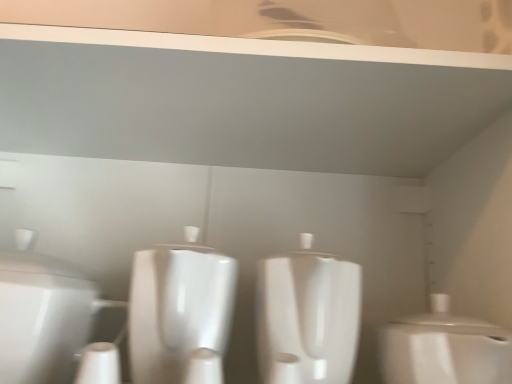
Question: Are white glossy toilet at center, acting as the 2th toilet starting from the right, and white glossy toilet at right, which is the first toilet from right to left, located far from each other?

Choices:
 (A) no
 (B) yes

Answer: (A)

Question: From the image's perspective, does white glossy toilet at center, positioned as the second toilet in left-to-right order, appear higher than white glossy toilet at right, which is the third toilet from left to right?

Choices:
 (A) yes
 (B) no

Answer: (A)

Question: From the image's perspective, is white glossy toilet at center, acting as the 2th toilet starting from the right, below white glossy toilet at right, which is the first toilet from right to left?

Choices:
 (A) yes
 (B) no

Answer: (B)

Question: Is white glossy toilet at center, acting as the 2th toilet starting from the right, oriented towards white glossy toilet at right, which is the first toilet from right to left?

Choices:
 (A) yes
 (B) no

Answer: (B)

Question: Does white glossy toilet at center, acting as the 2th toilet starting from the right, come behind white glossy toilet at right, which is the first toilet from right to left?

Choices:
 (A) yes
 (B) no

Answer: (A)

Question: From the image's perspective, is white glossy toilet at right, which is the third toilet from left to right, positioned above or below white glossy toilet at left, the 1th toilet when ordered from left to right?

Choices:
 (A) above
 (B) below

Answer: (B)

Question: From a real-world perspective, is white glossy toilet at right, which is the first toilet from right to left, above or below white glossy toilet at left, the third toilet from the right?

Choices:
 (A) above
 (B) below

Answer: (B)

Question: Do you think white glossy toilet at right, which is the third toilet from left to right, is within white glossy toilet at left, the third toilet from the right, or outside of it?

Choices:
 (A) outside
 (B) inside

Answer: (A)

Question: Considering the positions of white glossy toilet at right, which is the first toilet from right to left, and white glossy toilet at left, the third toilet from the right, in the image, is white glossy toilet at right, which is the first toilet from right to left, taller or shorter than white glossy toilet at left, the third toilet from the right,?

Choices:
 (A) short
 (B) tall

Answer: (A)

Question: From a real-world perspective, is white glossy toilet at left, the 1th toilet when ordered from left to right, physically located above or below white glossy toilet at right, which is the third toilet from left to right?

Choices:
 (A) below
 (B) above

Answer: (B)

Question: Is white glossy toilet at left, the 1th toilet when ordered from left to right, wider or thinner than white glossy toilet at right, which is the third toilet from left to right?

Choices:
 (A) wide
 (B) thin

Answer: (A)

Question: In terms of size, does white glossy toilet at left, the third toilet from the right, appear bigger or smaller than white glossy toilet at right, which is the first toilet from right to left?

Choices:
 (A) big
 (B) small

Answer: (A)

Question: Is white glossy toilet at left, the third toilet from the right, situated inside white glossy toilet at right, which is the first toilet from right to left, or outside?

Choices:
 (A) outside
 (B) inside

Answer: (A)

Question: Considering the positions of white glossy toilet at center, positioned as the second toilet in left-to-right order, and white glossy toilet at left, the 1th toilet when ordered from left to right, in the image, is white glossy toilet at center, positioned as the second toilet in left-to-right order, taller or shorter than white glossy toilet at left, the 1th toilet when ordered from left to right,?

Choices:
 (A) short
 (B) tall

Answer: (B)

Question: Is point (348, 314) positioned closer to the camera than point (7, 359)?

Choices:
 (A) farther
 (B) closer

Answer: (A)